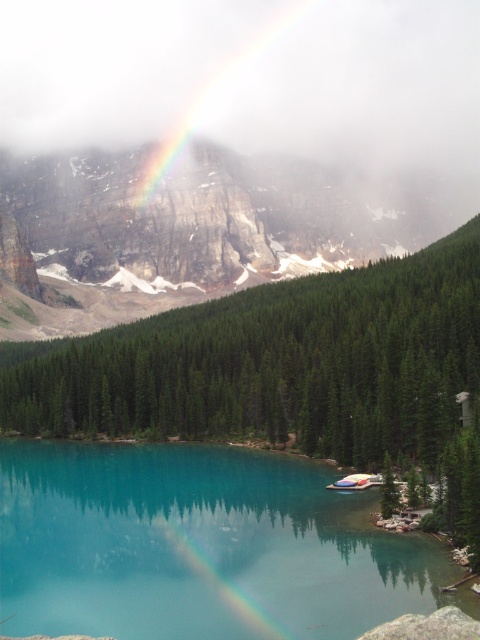
Who is shorter, green matte tree at center or turquoise glassy lake at lower center?

turquoise glassy lake at lower center is shorter.

Which of these two, green matte tree at center or turquoise glassy lake at lower center, stands taller?

Standing taller between the two is green matte tree at center.

Locate an element on the screen. This screenshot has height=640, width=480. green matte tree at center is located at coordinates (287, 371).

Is turquoise glassy lake at lower center positioned at the back of rainbow at center?

No, it is not.

Can you confirm if turquoise glassy lake at lower center is positioned above rainbow at center?

No, turquoise glassy lake at lower center is not above rainbow at center.

Image resolution: width=480 pixels, height=640 pixels. What do you see at coordinates (200, 547) in the screenshot?
I see `turquoise glassy lake at lower center` at bounding box center [200, 547].

Find the location of a particular element. turquoise glassy lake at lower center is located at coordinates (200, 547).

Is green matte tree at center below rainbow at center?

Actually, green matte tree at center is above rainbow at center.

The height and width of the screenshot is (640, 480). Find the location of `green matte tree at center`. green matte tree at center is located at coordinates (287, 371).